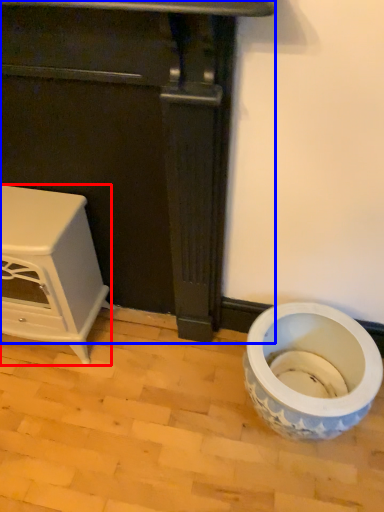
Question: Among these objects, which one is farthest to the camera, furniture (highlighted by a red box) or furniture (highlighted by a blue box)?

Choices:
 (A) furniture
 (B) furniture

Answer: (A)